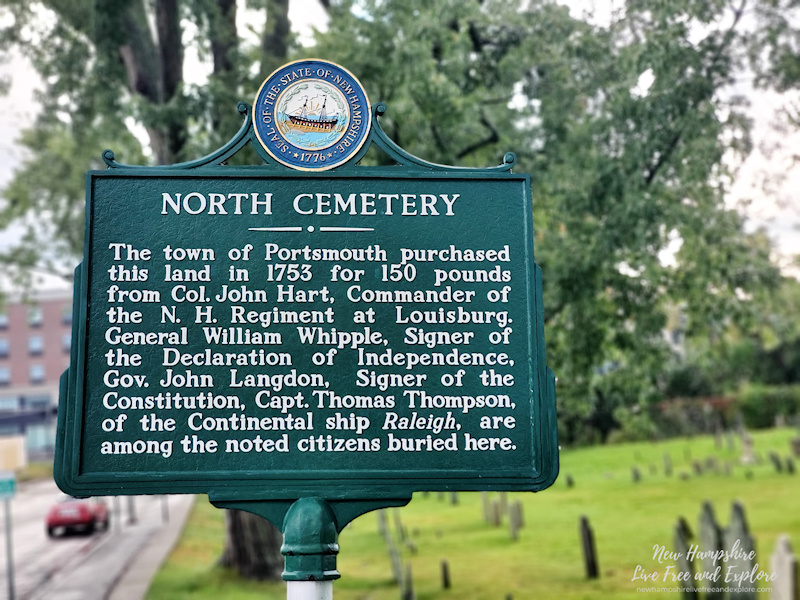
Identify the location of window. The height and width of the screenshot is (600, 800). (34, 345).